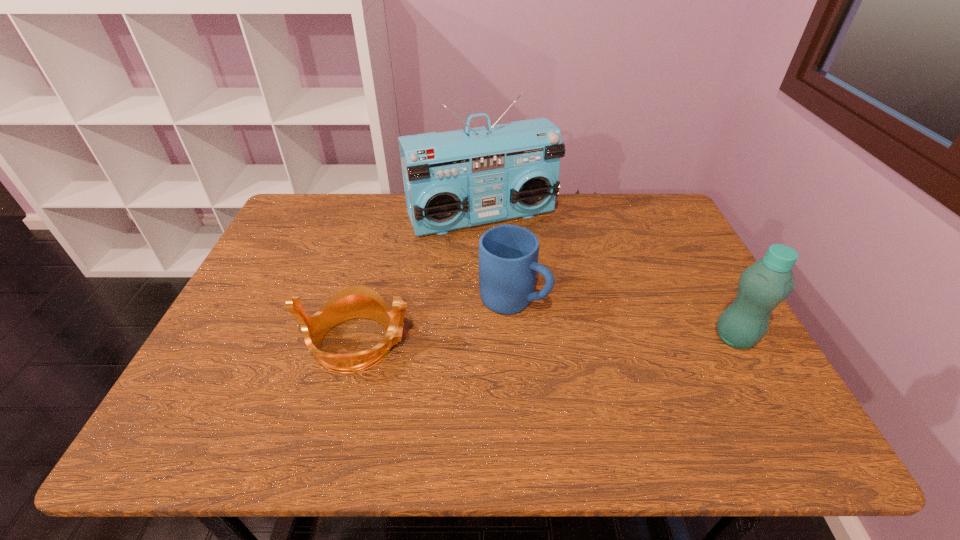
In order to click on the shortest object in this screenshot , I will do `click(353, 302)`.

Where is `water bottle`? Image resolution: width=960 pixels, height=540 pixels. water bottle is located at coordinates (762, 286).

At what (x,y) coordinates should I click in order to perform the action: click on the rightmost object. Please return your answer as a coordinate pair (x, y). Image resolution: width=960 pixels, height=540 pixels. Looking at the image, I should click on (762, 286).

You are a GUI agent. You are given a task and a screenshot of the screen. Output one action in this format:
    pyautogui.click(x=<x>, y=<y>)
    Task: Click on the tallest object
    The width and height of the screenshot is (960, 540).
    Given the screenshot: What is the action you would take?
    pyautogui.click(x=455, y=179)

Locate an element on the screen. Image resolution: width=960 pixels, height=540 pixels. the farthest object is located at coordinates (455, 179).

Find the location of a particular element. This screenshot has height=540, width=960. the third tallest object is located at coordinates [x=508, y=254].

The height and width of the screenshot is (540, 960). In order to click on free space located at the front emblem of the tiara in this screenshot , I will do `click(460, 342)`.

Where is `vacant area situated 0.320m on the front-facing side of the farthest object`? vacant area situated 0.320m on the front-facing side of the farthest object is located at coordinates (552, 318).

This screenshot has width=960, height=540. Find the location of `vacant area situated 0.250m on the front-facing side of the farthest object`. vacant area situated 0.250m on the front-facing side of the farthest object is located at coordinates (540, 299).

This screenshot has height=540, width=960. I want to click on vacant region located on the front-facing side of the farthest object, so click(516, 257).